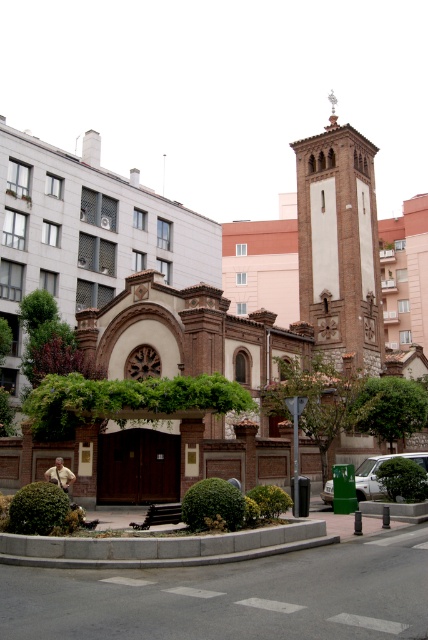
You are a photographer planning to take a wide shot of the brown brick church at center and the green matte car at lower right. Given that the church is larger than the car, where should you position the car in relation to the church to maintain proper perspective?

Since the brown brick church at center is larger than the green matte car at lower right, you should position the car closer to the camera than the church to maintain proper perspective.

You are standing at the entrance of the historic building and want to walk towards the point labeled as point (372, 467). However, there is an obstacle at point (341, 257). Will you encounter the obstacle before reaching your destination?

Since point (341, 257) is behind point (372, 467), you will not encounter the obstacle at point (341, 257) before reaching your destination at point (372, 467).

You are standing in front of the historic building and want to determine the relative positions of two points marked in the scene. Which point is closer to you, point [151,326] or point [341,250]?

Point [151,326] is closer to the viewer than point [341,250].